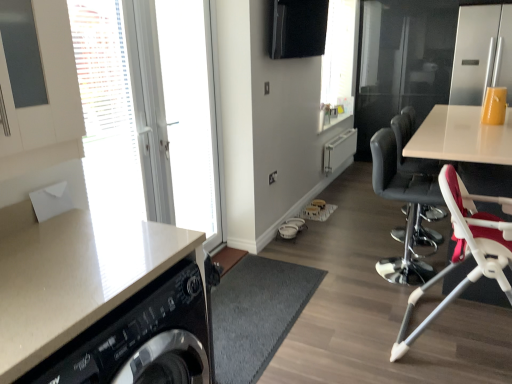
The width and height of the screenshot is (512, 384). What are the coordinates of `vacant area that lies between black leather bar stool at right and white glossy door at left, the 2th window from the front` in the screenshot? It's located at (310, 257).